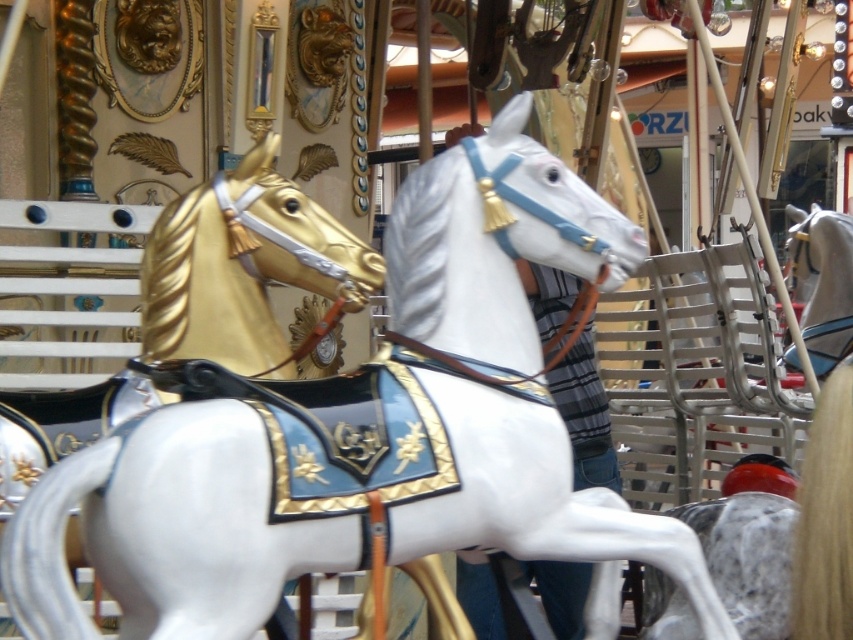
You are a child who wants to choose between the gold polished wood horse at upper left and the shiny silver horse at center on the carousel. Which horse is bigger?

The shiny silver horse at center is bigger than the gold polished wood horse at upper left.

You are a photographer standing in front of the carousel. You want to take a photo that includes both the white glossy horse at center and the gold polished wood horse at upper left. Based on their positions, which horse will appear larger in the photo?

The white glossy horse at center appears larger in the photo because it is closer to the viewer than the gold polished wood horse at upper left.